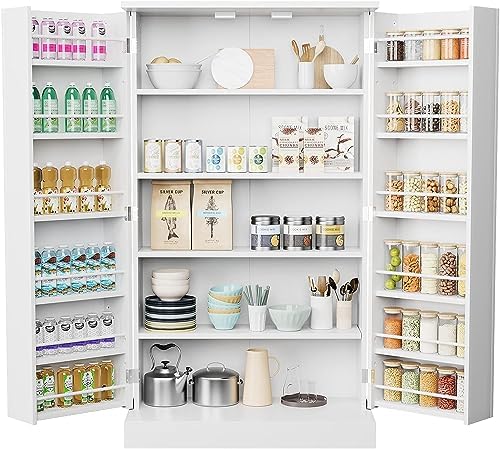
Where is `glass jars on the first shelf`? Image resolution: width=500 pixels, height=449 pixels. glass jars on the first shelf is located at coordinates (466, 41), (448, 43), (431, 43), (413, 45), (394, 49).